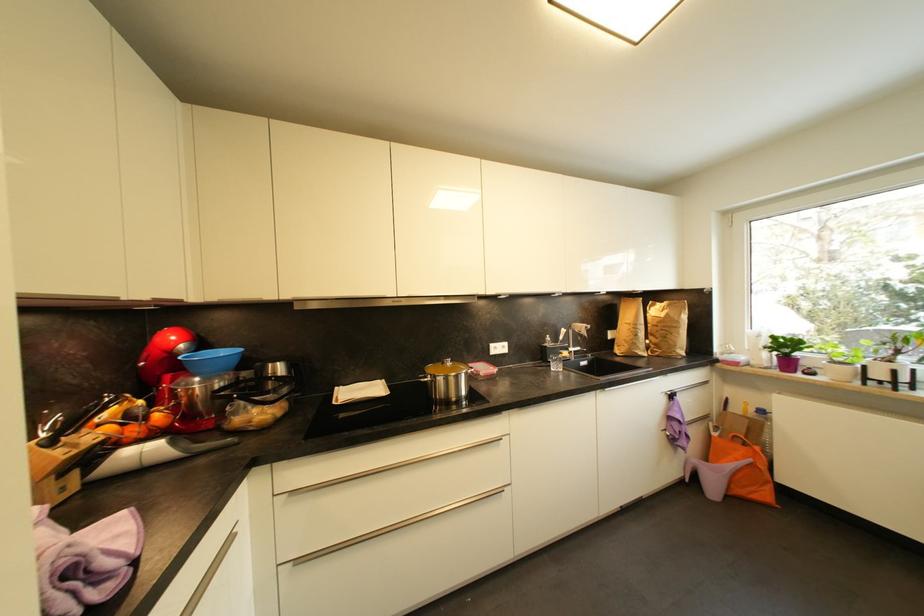
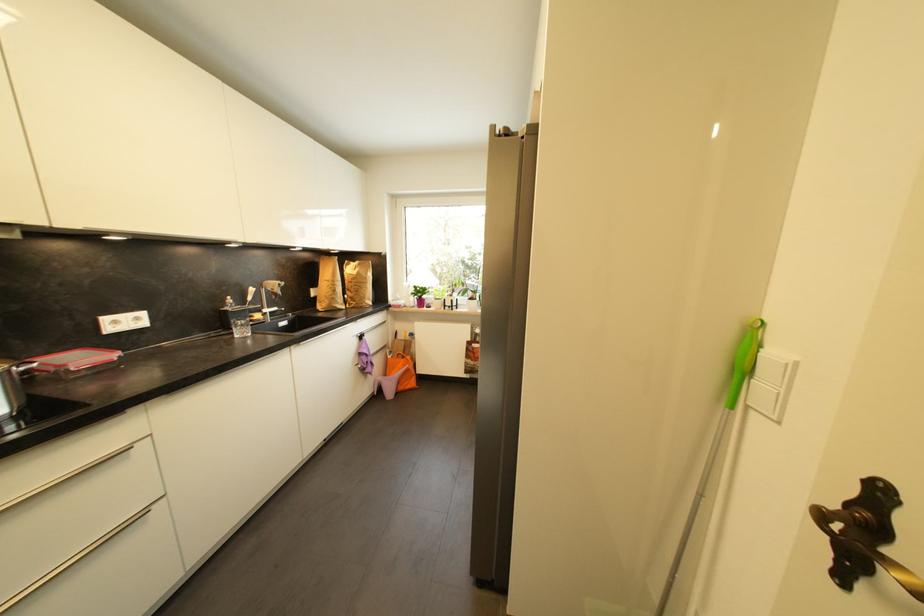
Where in the second image is the point corresponding to (468,394) from the first image?

(8, 411)